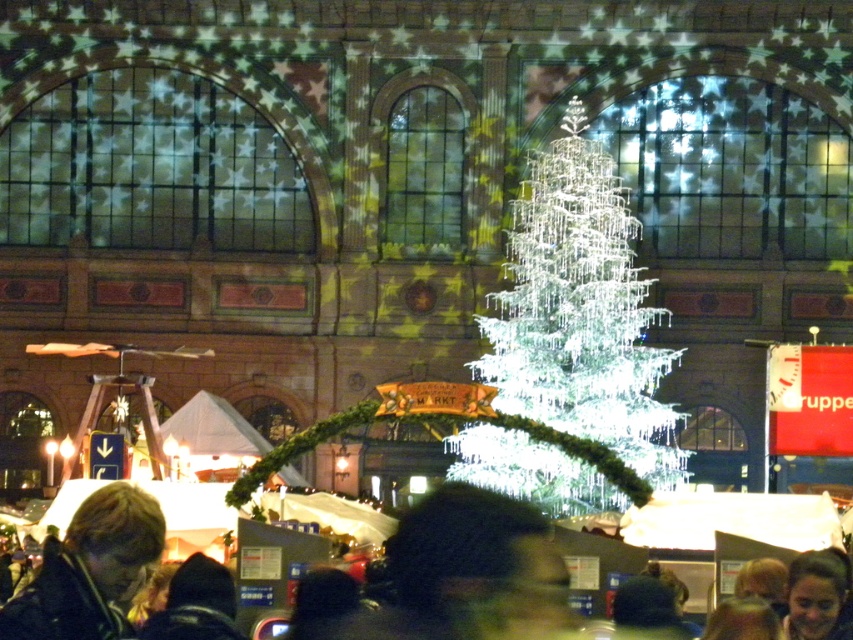
Between point (125, 560) and point (787, 602), which one is positioned behind?

Positioned behind is point (787, 602).

Can you confirm if matte black jacket at lower left is positioned to the right of smooth skin face at lower right?

Incorrect, matte black jacket at lower left is not on the right side of smooth skin face at lower right.

Identify the location of matte black jacket at lower left. (91, 570).

Is icy white crystal at center to the right of matte black jacket at lower left from the viewer's perspective?

Correct, you'll find icy white crystal at center to the right of matte black jacket at lower left.

Can you confirm if icy white crystal at center is bigger than matte black jacket at lower left?

Yes, icy white crystal at center is bigger than matte black jacket at lower left.

In order to click on icy white crystal at center in this screenshot , I will do `click(579, 310)`.

You are a GUI agent. You are given a task and a screenshot of the screen. Output one action in this format:
    pyautogui.click(x=<x>, y=<y>)
    Task: Click on the icy white crystal at center
    
    Given the screenshot: What is the action you would take?
    pyautogui.click(x=579, y=310)

What do you see at coordinates (579, 310) in the screenshot?
I see `icy white crystal at center` at bounding box center [579, 310].

Can you confirm if icy white crystal at center is positioned to the left of smooth skin face at lower right?

Correct, you'll find icy white crystal at center to the left of smooth skin face at lower right.

Which is behind, point (596, 166) or point (846, 589)?

The point (596, 166) is behind.

Locate an element on the screen. The height and width of the screenshot is (640, 853). icy white crystal at center is located at coordinates (579, 310).